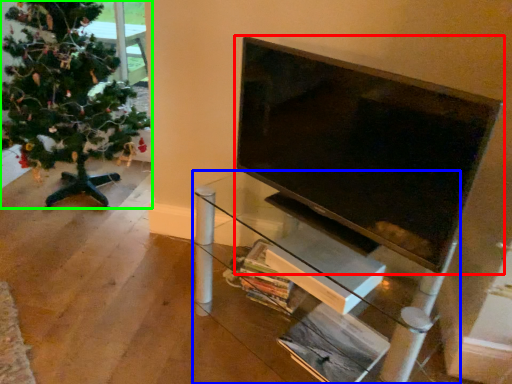
Question: Estimate the real-world distances between objects in this image. Which object is farther from television (highlighted by a red box), furniture (highlighted by a blue box) or christmas tree (highlighted by a green box)?

Choices:
 (A) furniture
 (B) christmas tree

Answer: (B)